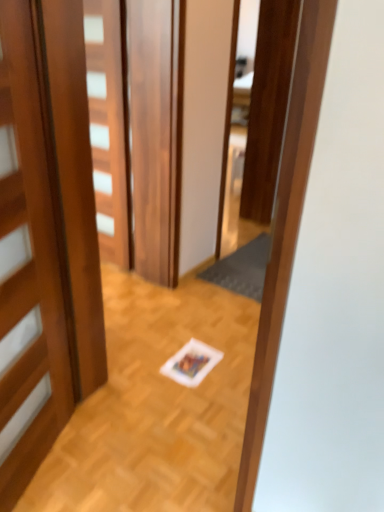
Image resolution: width=384 pixels, height=512 pixels. Describe the element at coordinates (107, 128) in the screenshot. I see `wooden door at center, which is counted as the 2th door, starting from the front` at that location.

Find the location of a particular element. The height and width of the screenshot is (512, 384). dark gray textured mat at center is located at coordinates (242, 268).

Is wooden door at center, which appears as the first door when viewed from the back, placed right next to wooden door at left, arranged as the 1th door when viewed from the front?

No, wooden door at center, which appears as the first door when viewed from the back, is not with wooden door at left, arranged as the 1th door when viewed from the front.

How many degrees apart are the facing directions of wooden door at center, which is counted as the 2th door, starting from the front, and wooden door at left, arranged as the 1th door when viewed from the front?

They differ by 115 degrees in their facing directions.

From the image's perspective, is wooden door at center, which appears as the first door when viewed from the back, above wooden door at left, arranged as the 1th door when viewed from the front?

Correct, wooden door at center, which appears as the first door when viewed from the back, appears higher than wooden door at left, arranged as the 1th door when viewed from the front, in the image.

Does point (94, 182) appear closer or farther from the camera than point (35, 378)?

Clearly, point (94, 182) is more distant from the camera than point (35, 378).

Is wooden door at center, which appears as the first door when viewed from the back, looking in the opposite direction of dark gray textured mat at center?

No, dark gray textured mat at center is not at the back of wooden door at center, which appears as the first door when viewed from the back.

Are wooden door at center, which appears as the first door when viewed from the back, and dark gray textured mat at center located far from each other?

Yes, wooden door at center, which appears as the first door when viewed from the back, and dark gray textured mat at center are quite far apart.

From the image's perspective, between wooden door at center, which appears as the first door when viewed from the back, and dark gray textured mat at center, who is located below?

From the image's view, dark gray textured mat at center is below.

Is wooden door at left, arranged as the 1th door when viewed from the front, smaller than dark gray textured mat at center?

No, wooden door at left, arranged as the 1th door when viewed from the front, is not smaller than dark gray textured mat at center.

Considering the relative positions of wooden door at left, arranged as the 1th door when viewed from the front, and dark gray textured mat at center in the image provided, is wooden door at left, arranged as the 1th door when viewed from the front, to the left of dark gray textured mat at center from the viewer's perspective?

Yes, wooden door at left, arranged as the 1th door when viewed from the front, is to the left of dark gray textured mat at center.

Considering their positions, is wooden door at left, which is counted as the 2th door, starting from the back, located in front of or behind dark gray textured mat at center?

wooden door at left, which is counted as the 2th door, starting from the back, is in front of dark gray textured mat at center.

From the image's perspective, which is below, wooden door at left, arranged as the 1th door when viewed from the front, or dark gray textured mat at center?

wooden door at left, arranged as the 1th door when viewed from the front, is shown below in the image.

Would you consider wooden door at left, arranged as the 1th door when viewed from the front, to be distant from wooden door at center, which appears as the first door when viewed from the back?

Yes.

Considering the relative positions of wooden door at left, arranged as the 1th door when viewed from the front, and wooden door at center, which appears as the first door when viewed from the back, in the image provided, is wooden door at left, arranged as the 1th door when viewed from the front, to the left or to the right of wooden door at center, which appears as the first door when viewed from the back,?

Based on their positions, wooden door at left, arranged as the 1th door when viewed from the front, is located to the left of wooden door at center, which appears as the first door when viewed from the back.

From a real-world perspective, between wooden door at left, which is counted as the 2th door, starting from the back, and wooden door at center, which is counted as the 2th door, starting from the front, who is vertically lower?

wooden door at left, which is counted as the 2th door, starting from the back, is physically lower.

Based on the photo, is dark gray textured mat at center oriented towards wooden door at left, which is counted as the 2th door, starting from the back?

Yes, dark gray textured mat at center is aimed at wooden door at left, which is counted as the 2th door, starting from the back.

Is dark gray textured mat at center wider or thinner than wooden door at left, arranged as the 1th door when viewed from the front?

Clearly, dark gray textured mat at center has more width compared to wooden door at left, arranged as the 1th door when viewed from the front.

Consider the image. Do you think dark gray textured mat at center is within wooden door at left, arranged as the 1th door when viewed from the front, or outside of it?

dark gray textured mat at center lies outside wooden door at left, arranged as the 1th door when viewed from the front.

Is dark gray textured mat at center not close to wooden door at center, which is counted as the 2th door, starting from the front?

Absolutely, dark gray textured mat at center is distant from wooden door at center, which is counted as the 2th door, starting from the front.

Does point (260, 237) come farther from viewer compared to point (95, 128)?

Yes, point (260, 237) is farther from viewer.

Would you say dark gray textured mat at center is to the left or to the right of wooden door at center, which appears as the first door when viewed from the back, in the picture?

dark gray textured mat at center is to the right of wooden door at center, which appears as the first door when viewed from the back.

Can you confirm if dark gray textured mat at center is thinner than wooden door at center, which is counted as the 2th door, starting from the front?

No, dark gray textured mat at center is not thinner than wooden door at center, which is counted as the 2th door, starting from the front.

At what (x,y) coordinates should I click in order to perform the action: click on door directly beneath the wooden door at center, which appears as the first door when viewed from the back (from a real-world perspective). Please return your answer as a coordinate pair (x, y). The image size is (384, 512). Looking at the image, I should click on (28, 262).

At what (x,y) coordinates should I click in order to perform the action: click on doormat lying behind the wooden door at center, which appears as the first door when viewed from the back. Please return your answer as a coordinate pair (x, y). Looking at the image, I should click on [242, 268].

Considering their positions, is wooden door at left, arranged as the 1th door when viewed from the front, positioned further to dark gray textured mat at center than wooden door at center, which appears as the first door when viewed from the back?

Based on the image, wooden door at left, arranged as the 1th door when viewed from the front, appears to be further to dark gray textured mat at center.

Looking at the image, which one is located closer to wooden door at center, which is counted as the 2th door, starting from the front, wooden door at left, arranged as the 1th door when viewed from the front, or dark gray textured mat at center?

Among the two, dark gray textured mat at center is located nearer to wooden door at center, which is counted as the 2th door, starting from the front.

Based on their spatial positions, is dark gray textured mat at center or wooden door at left, arranged as the 1th door when viewed from the front, further from wooden door at center, which is counted as the 2th door, starting from the front?

The object further to wooden door at center, which is counted as the 2th door, starting from the front, is wooden door at left, arranged as the 1th door when viewed from the front.

From the picture: Estimate the real-world distances between objects in this image. Which object is further from wooden door at left, which is counted as the 2th door, starting from the back, wooden door at center, which is counted as the 2th door, starting from the front, or dark gray textured mat at center?

The object further to wooden door at left, which is counted as the 2th door, starting from the back, is dark gray textured mat at center.

Considering their positions, is dark gray textured mat at center positioned further to wooden door at left, which is counted as the 2th door, starting from the back, than wooden door at center, which appears as the first door when viewed from the back?

dark gray textured mat at center is further to wooden door at left, which is counted as the 2th door, starting from the back.

From the image, which object appears to be farther from dark gray textured mat at center, wooden door at center, which appears as the first door when viewed from the back, or wooden door at left, which is counted as the 2th door, starting from the back?

The object further to dark gray textured mat at center is wooden door at left, which is counted as the 2th door, starting from the back.

Where is `door between wooden door at left, which is counted as the 2th door, starting from the back, and dark gray textured mat at center, along the z-axis`? door between wooden door at left, which is counted as the 2th door, starting from the back, and dark gray textured mat at center, along the z-axis is located at coordinates (107, 128).